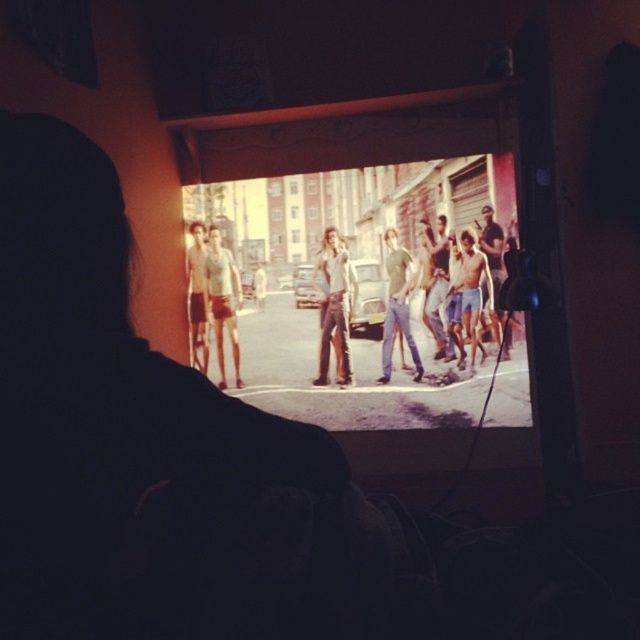
You are sitting in a home theater and want to adjust your seating position so that you can comfortably watch the matte black screen at center. If your current distance from the screen is 1.5 meters, should you move closer or farther away to match the recommended viewing distance of 1.2 meters for optimal comfort?

The recommended viewing distance is 1.2 meters, and you are currently 1.5 meters away from the matte black screen at center. To achieve optimal comfort, you should move closer to the matte black screen at center by 0.3 meters.

You are sitting in a home theater room and want to watch a movie on the screen. You notice two items at the center of the image. Which one is closer to you, the matte black screen at center or the light green cotton shirt at center?

The matte black screen at center is closer to you than the light green cotton shirt at center.

You are in a home theater room and see the image on the screen. The screen has a coordinate system where the bottom left corner is the origin. Where is the light green cotton shirt at center located on the screen?

The light green cotton shirt at center is located at coordinates point (397,305) on the screen.